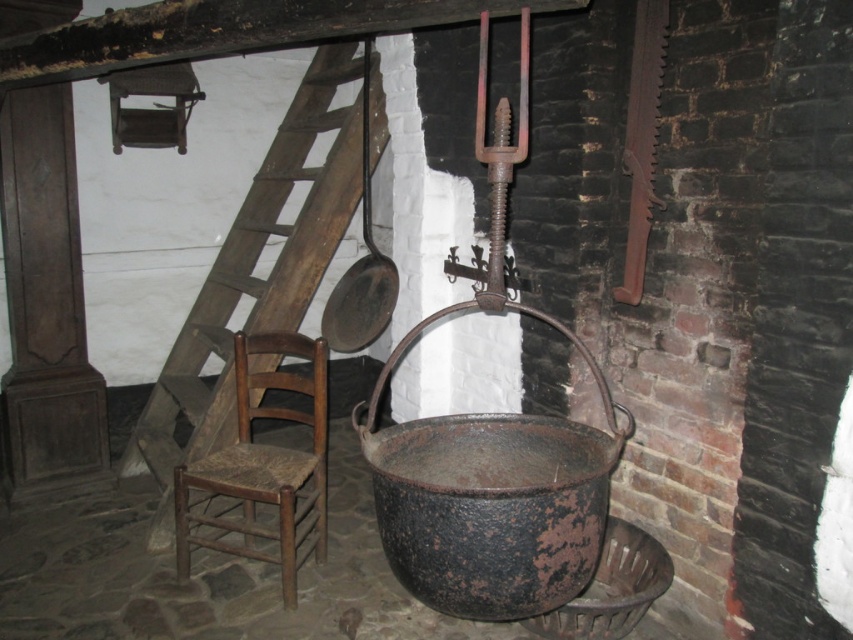
Question: Is wooden ladder at center smaller than dark brown wooden beam at upper center?

Choices:
 (A) yes
 (B) no

Answer: (B)

Question: Can you confirm if wooden ladder at center is positioned above wooden woven seat chair at left?

Choices:
 (A) no
 (B) yes

Answer: (B)

Question: Among these objects, which one is nearest to the camera?

Choices:
 (A) wooden woven seat chair at left
 (B) wooden ladder at center

Answer: (A)

Question: Which object appears closest to the camera in this image?

Choices:
 (A) dark brown wooden beam at upper center
 (B) wooden woven seat chair at left

Answer: (A)

Question: Does wooden ladder at center appear over dark brown wooden beam at upper center?

Choices:
 (A) yes
 (B) no

Answer: (B)

Question: Among these objects, which one is nearest to the camera?

Choices:
 (A) wooden ladder at center
 (B) dark brown wooden beam at upper center
 (C) wooden woven seat chair at left

Answer: (B)